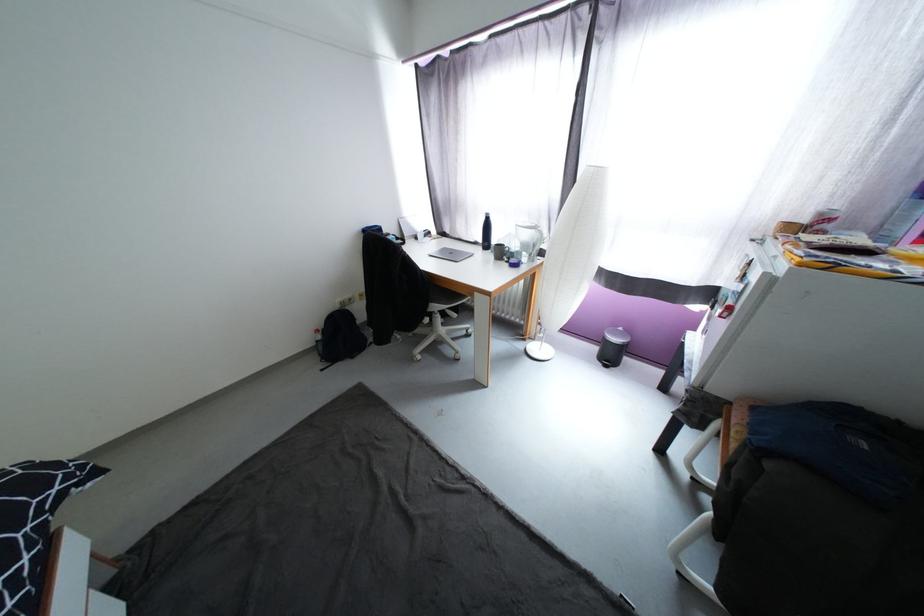
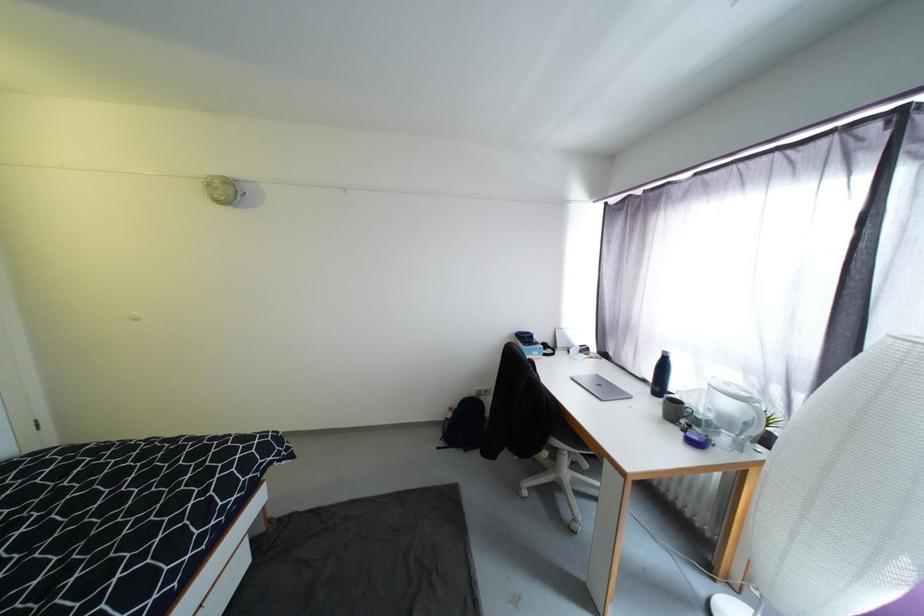
Find the pixel in the second image that matches point (322, 333) in the first image.

(456, 410)